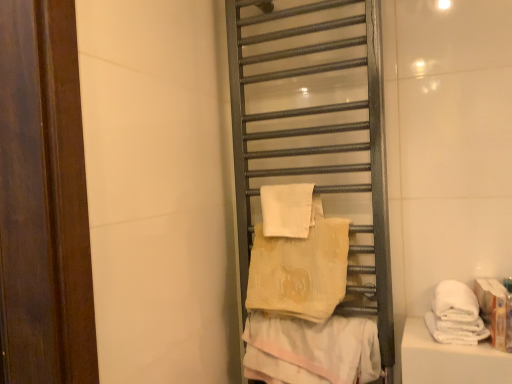
Question: Which direction should I rotate to look at beige textured towel at center, arranged as the 1th towel when ordered from the bottom?

Choices:
 (A) right
 (B) left

Answer: (A)

Question: Is metallic towel rack at center positioned beyond the bounds of white soft towel at center, arranged as the first towel when viewed from the top?

Choices:
 (A) no
 (B) yes

Answer: (B)

Question: Are metallic towel rack at center and white soft towel at center, acting as the fourth towel starting from the bottom, located far from each other?

Choices:
 (A) no
 (B) yes

Answer: (A)

Question: From the image's perspective, is metallic towel rack at center located beneath white soft towel at center, acting as the fourth towel starting from the bottom?

Choices:
 (A) yes
 (B) no

Answer: (B)

Question: Can you confirm if metallic towel rack at center is smaller than white soft towel at center, arranged as the first towel when viewed from the top?

Choices:
 (A) yes
 (B) no

Answer: (B)

Question: Is the depth of metallic towel rack at center less than that of white soft towel at center, acting as the fourth towel starting from the bottom?

Choices:
 (A) yes
 (B) no

Answer: (A)

Question: From a real-world perspective, does metallic towel rack at center stand above white soft towel at center, arranged as the first towel when viewed from the top?

Choices:
 (A) no
 (B) yes

Answer: (B)

Question: Is white soft towel at right, arranged as the second towel when ordered from the bottom, taller than white soft towel at center, acting as the fourth towel starting from the bottom?

Choices:
 (A) yes
 (B) no

Answer: (B)

Question: Is white soft towel at right, which appears as the third towel when viewed from the top, in front of white soft towel at center, arranged as the first towel when viewed from the top?

Choices:
 (A) yes
 (B) no

Answer: (A)

Question: Considering the relative sizes of white soft towel at right, arranged as the second towel when ordered from the bottom, and white soft towel at center, arranged as the first towel when viewed from the top, in the image provided, is white soft towel at right, arranged as the second towel when ordered from the bottom, shorter than white soft towel at center, arranged as the first towel when viewed from the top,?

Choices:
 (A) yes
 (B) no

Answer: (A)

Question: Is white soft towel at right, which appears as the third towel when viewed from the top, looking in the opposite direction of white soft towel at center, arranged as the first towel when viewed from the top?

Choices:
 (A) yes
 (B) no

Answer: (B)

Question: Is the depth of white soft towel at right, arranged as the second towel when ordered from the bottom, greater than that of white soft towel at center, acting as the fourth towel starting from the bottom?

Choices:
 (A) no
 (B) yes

Answer: (A)

Question: From a real-world perspective, is white soft towel at right, arranged as the second towel when ordered from the bottom, located beneath white soft towel at center, arranged as the first towel when viewed from the top?

Choices:
 (A) no
 (B) yes

Answer: (B)

Question: Is beige soft towel at center, acting as the second towel starting from the top, surrounded by beige textured towel at center, the 4th towel viewed from the top?

Choices:
 (A) no
 (B) yes

Answer: (A)